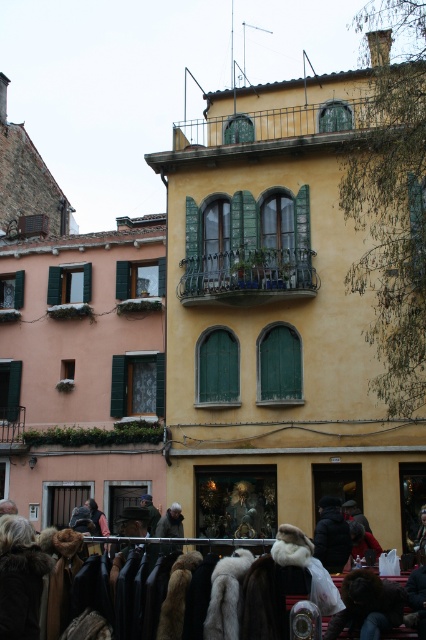
Looking at this image, you are a customer looking to buy a fur coat. You see two options in the shop window of the warm yellow building. The first is labeled as fur coats at lower center and the second is white fur coat at center. Which one is taller?

The fur coats at lower center has a greater height compared to the white fur coat at center, so the fur coats at lower center is taller.

You are a customer in the shop and want to try on both the white fur coat at center and the brown furry coat at lower center. Which coat should you pick up first to reach the one above it?

The white fur coat at center is above the brown furry coat at lower center, so you should pick up the brown furry coat at lower center first to reach the one above it.

You are a customer in the shop and want to buy a fur coat. The shop has two options displayed in the window. Which one is placed lower between the fur coats at lower center and the brown furry coat at lower center?

The fur coats at lower center is positioned under the brown furry coat at lower center, so the fur coats at lower center is placed lower than the brown furry coat at lower center.